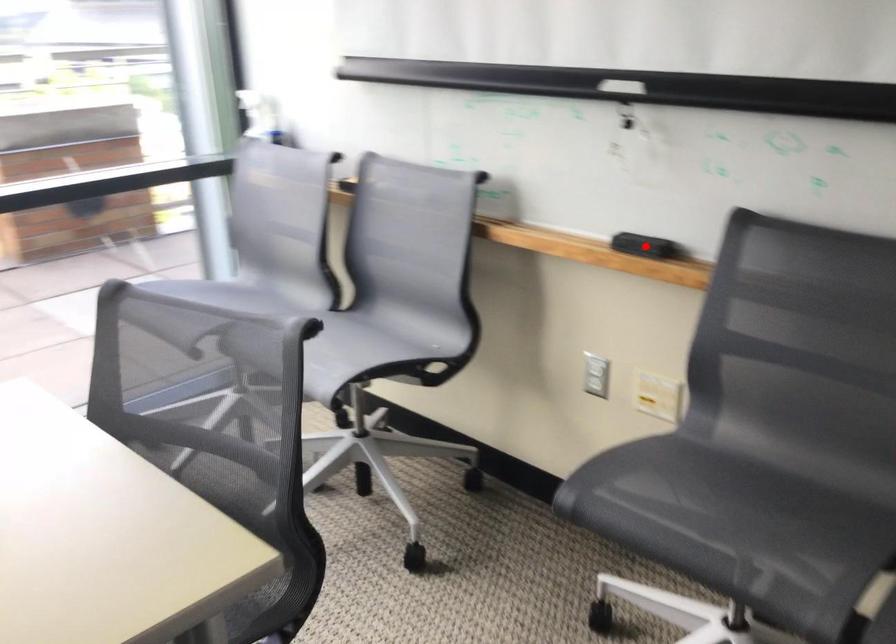
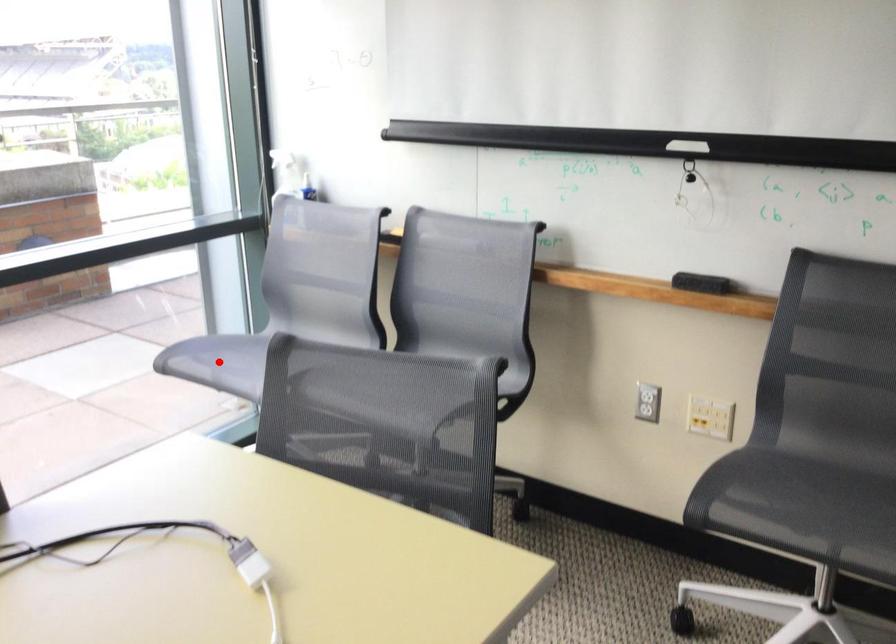
I am providing you with two images of the same scene from different viewpoints. A red point is marked on the first image and another point is marked on the second image. Does the point marked in image1 correspond to the same location as the one in image2?

No